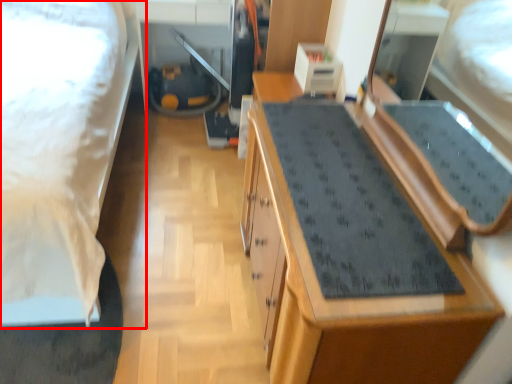
Question: From the image's perspective, what is the correct spatial positioning of bed (annotated by the red box) in reference to cabinetry?

Choices:
 (A) above
 (B) below

Answer: (A)